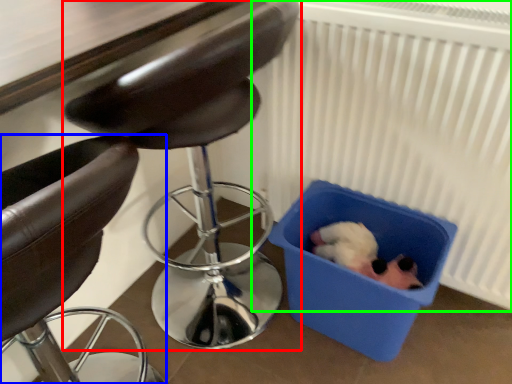
Question: Based on their relative distances, which object is farther from chair (highlighted by a red box)? Choose from chair (highlighted by a blue box) and radiator (highlighted by a green box).

Choices:
 (A) chair
 (B) radiator

Answer: (A)